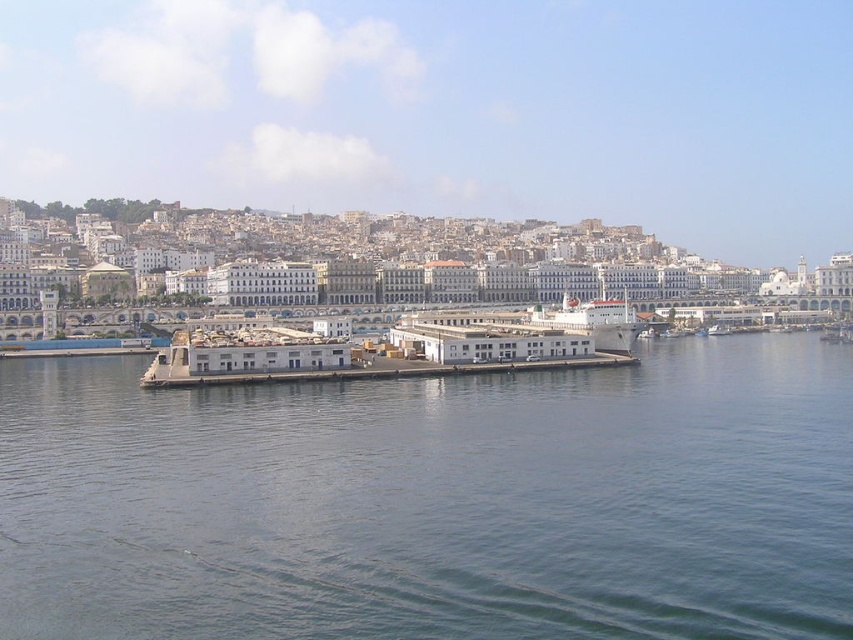
Question: Is gray concrete dock at center further to the viewer compared to white matte dock at center?

Choices:
 (A) yes
 (B) no

Answer: (B)

Question: Does gray concrete dock at center have a greater width compared to white matte dock at center?

Choices:
 (A) yes
 (B) no

Answer: (A)

Question: Among these points, which one is nearest to the camera?

Choices:
 (A) (267, 372)
 (B) (473, 448)

Answer: (B)

Question: From the image, what is the correct spatial relationship of gray concrete dock at center in relation to white matte dock at center?

Choices:
 (A) right
 (B) left

Answer: (B)

Question: Which of the following is the farthest from the observer?

Choices:
 (A) gray concrete dock at center
 (B) white matte dock at center

Answer: (B)

Question: Which point is closer to the camera?

Choices:
 (A) gray concrete dock at center
 (B) white matte dock at center

Answer: (A)